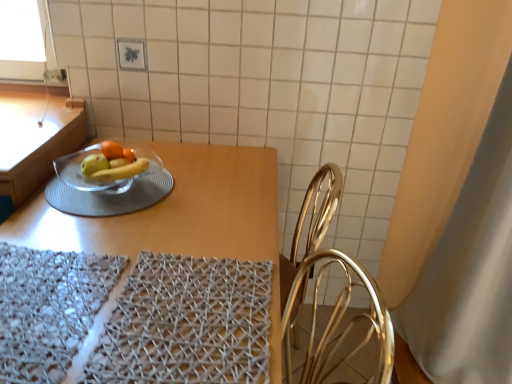
Find the location of `free space to the right of woven fabric place mat at lower left, which is the first place mat from left to right`. free space to the right of woven fabric place mat at lower left, which is the first place mat from left to right is located at coordinates (185, 330).